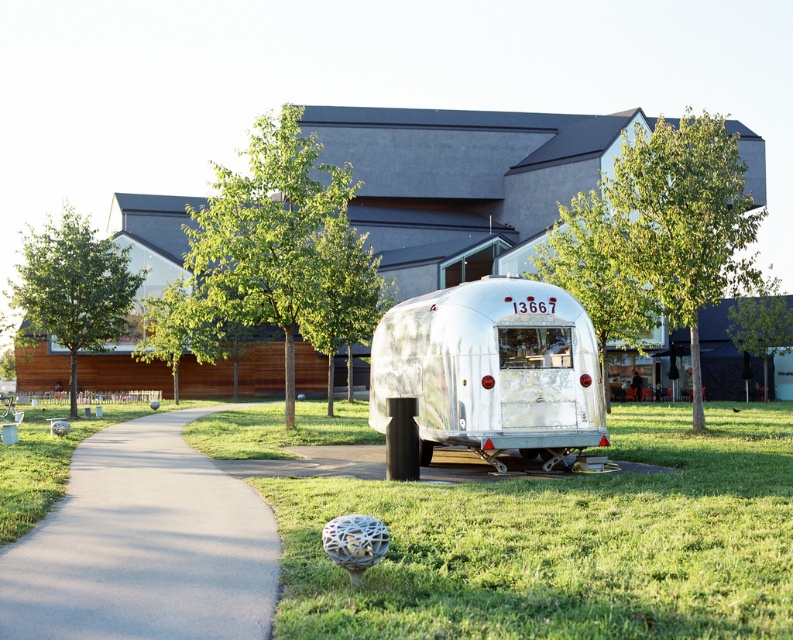
You are standing at the point marked as point (772, 573) and want to reach the vintage silver Airstream trailer parked on the grassy area. The path is 7.17 meters wide. Can your 2.5 meters wide truck fit through the path?

The path between you and the vintage silver Airstream trailer is 7.17 meters wide, so yes, your 2.5 meters wide truck can fit through the path since it is wider than the truck.

You are a delivery driver who needs to park your truck, which is 2 meters wide, in this area. Based on the scene, can you safely park your truck on the gray asphalt pavement at center without overlapping the silver metallic trailer at center?

The gray asphalt pavement at center might be wider than silver metallic trailer at center, so there is a possibility that the truck can park safely. However, since the exact width difference isn not specified, it is recommended to measure the space before proceeding.